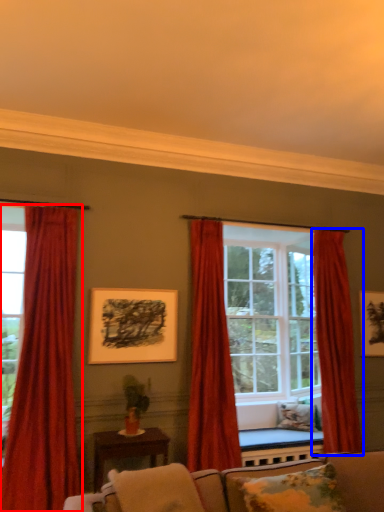
Question: Which object is further to the camera taking this photo, curtain (highlighted by a red box) or curtain (highlighted by a blue box)?

Choices:
 (A) curtain
 (B) curtain

Answer: (B)